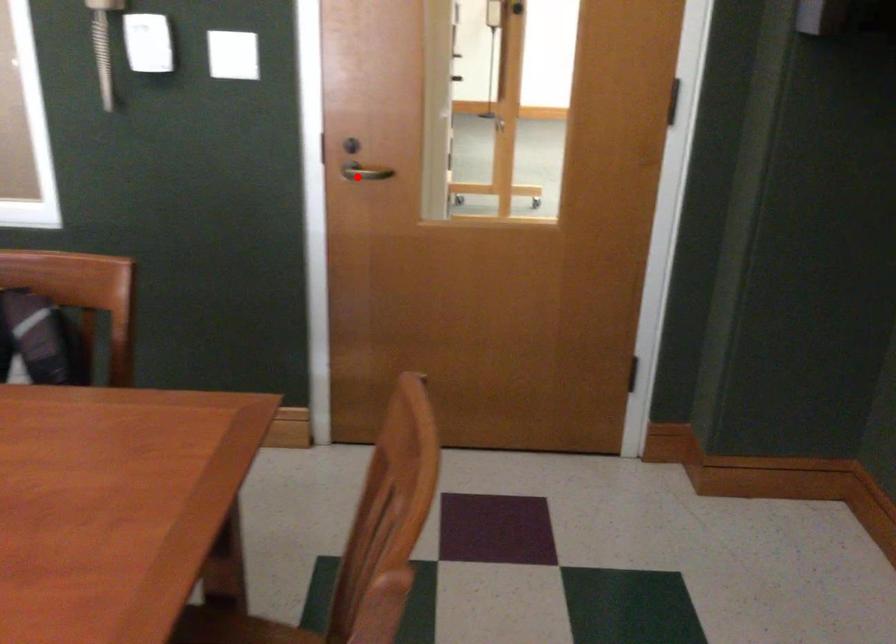
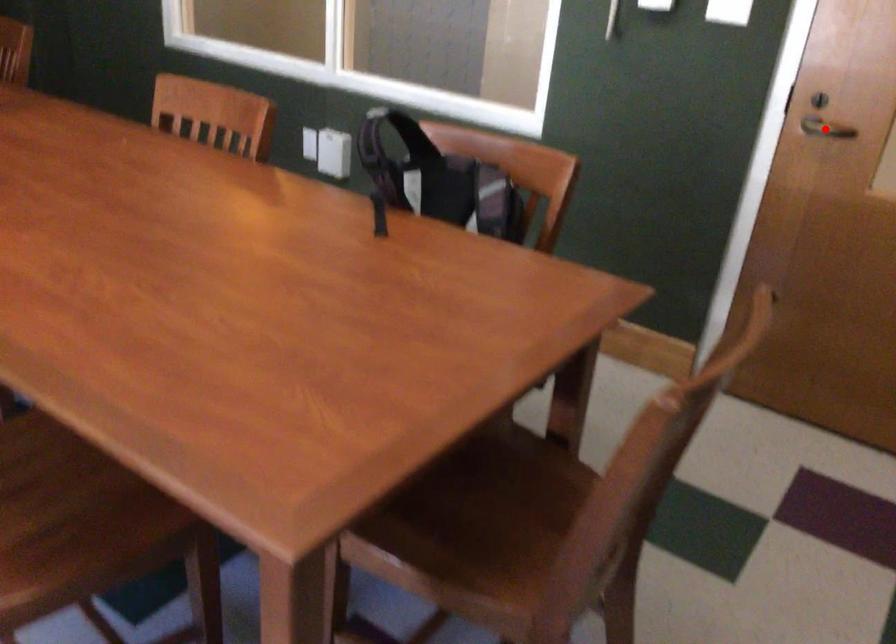
I am providing you with two images of the same scene from different viewpoints. A red point is marked on the first image and another point is marked on the second image. Do the highlighted points in image1 and image2 indicate the same real-world spot?

Yes